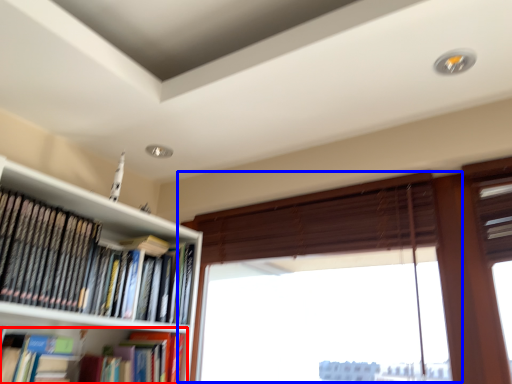
Question: Which object appears farthest to the camera in this image, book (highlighted by a red box) or window (highlighted by a blue box)?

Choices:
 (A) book
 (B) window

Answer: (A)